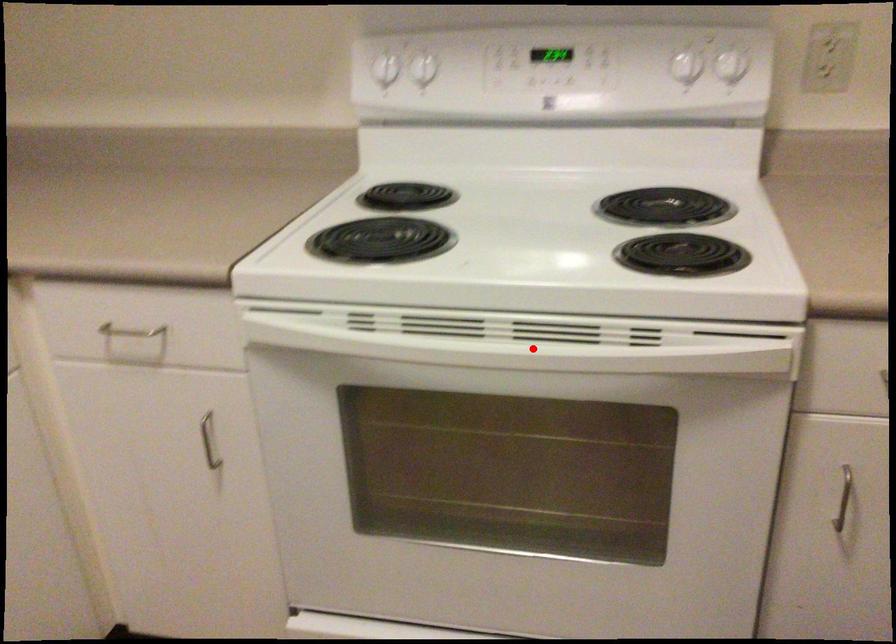
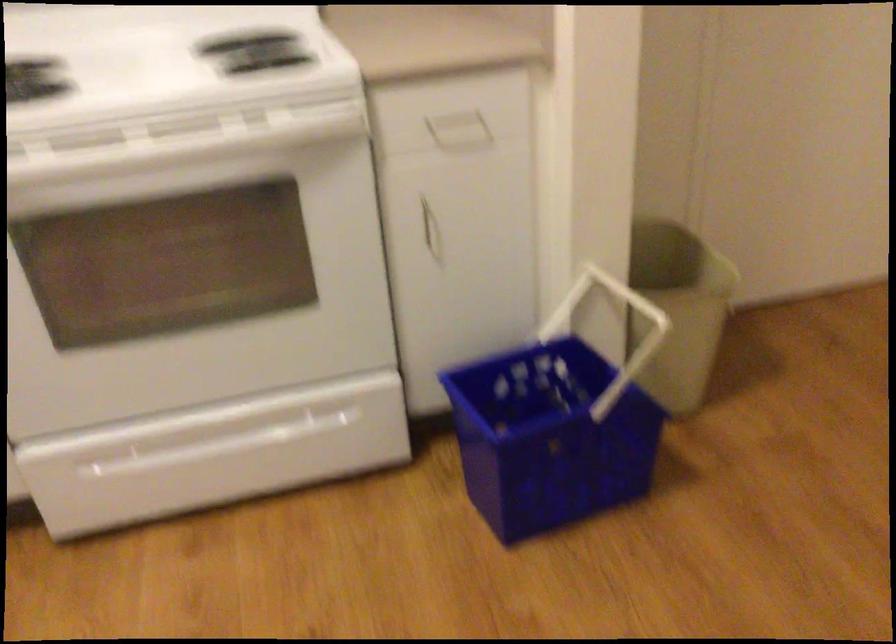
Find the pixel in the second image that matches the highlighted location in the first image.

(175, 143)